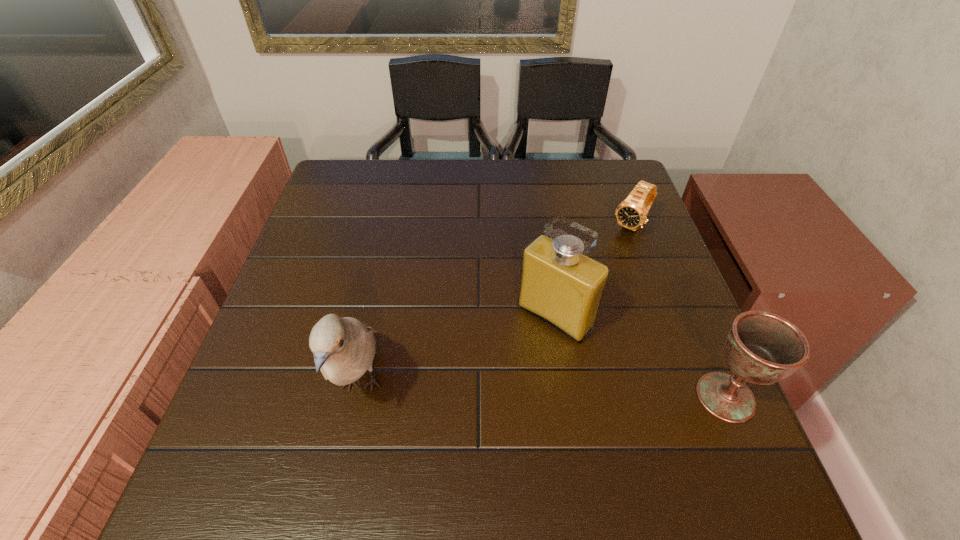
Locate an element on the screen. This screenshot has width=960, height=540. the leftmost object is located at coordinates (344, 348).

Locate an element on the screen. chalice is located at coordinates (x=761, y=348).

The height and width of the screenshot is (540, 960). I want to click on the shortest object, so click(x=631, y=213).

Where is `watch`? The width and height of the screenshot is (960, 540). watch is located at coordinates (631, 213).

You are a GUI agent. You are given a task and a screenshot of the screen. Output one action in this format:
    pyautogui.click(x=<x>, y=<y>)
    Task: Click on the perfume
    This screenshot has width=960, height=540.
    Given the screenshot: What is the action you would take?
    pyautogui.click(x=559, y=284)

Locate an element on the screen. The image size is (960, 540). vacant space located 0.130m on the back of the chalice is located at coordinates (692, 319).

The height and width of the screenshot is (540, 960). What are the coordinates of `vacant space located 0.150m on the face of the watch` in the screenshot? It's located at (595, 270).

Locate an element on the screen. The height and width of the screenshot is (540, 960). free space located on the face of the watch is located at coordinates (552, 322).

Identify the location of vacant space located on the face of the watch. The height and width of the screenshot is (540, 960). (584, 285).

Identify the location of vacant space located 0.050m on the front-facing side of the second object from left to right. (519, 353).